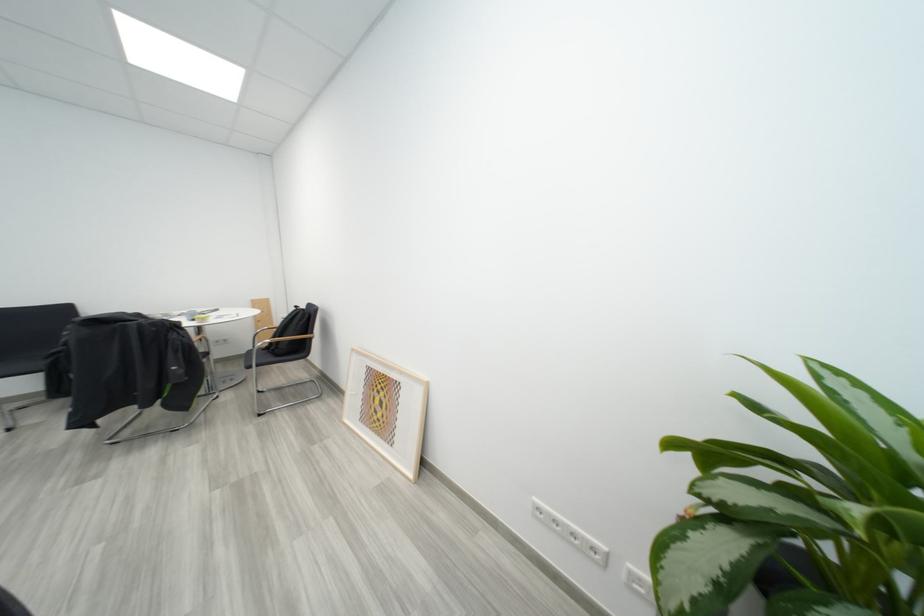
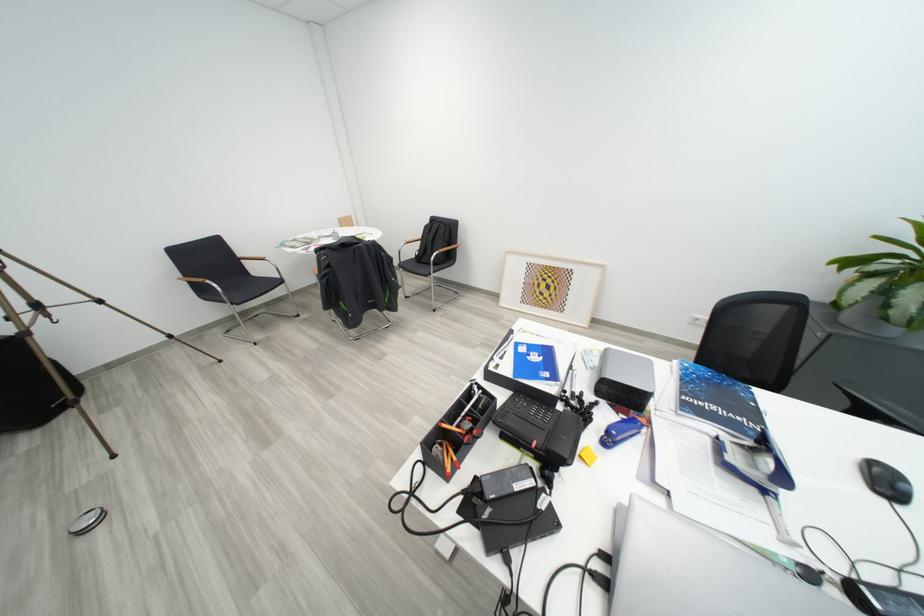
Question: What movement of the cameraman would produce the second image?

Choices:
 (A) Left
 (B) Right
 (C) Forward
 (D) Backward

Answer: (A)